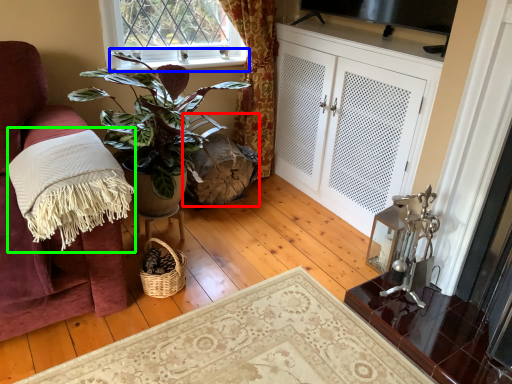
Question: Based on their relative distances, which object is nearer to swivel chair (highlighted by a red box)? Choose from window sill (highlighted by a blue box) and blanket (highlighted by a green box).

Choices:
 (A) window sill
 (B) blanket

Answer: (A)